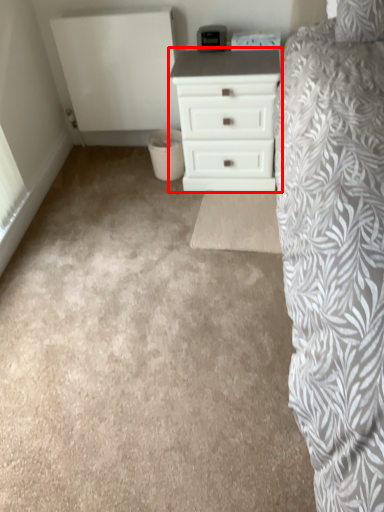
Question: From the image's perspective, where is chest of drawers (annotated by the red box) located in relation to plain in the image?

Choices:
 (A) above
 (B) below

Answer: (A)